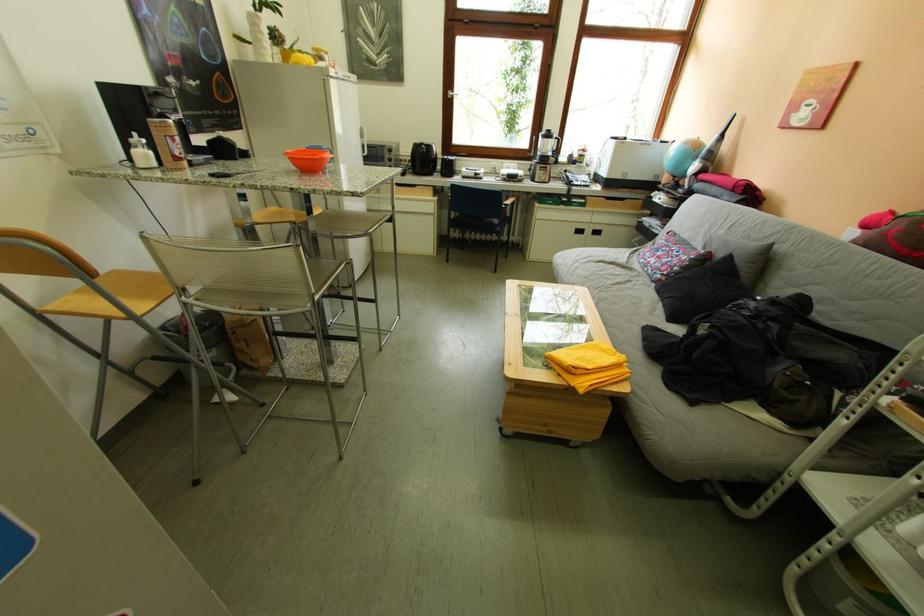
Image resolution: width=924 pixels, height=616 pixels. Describe the element at coordinates (665, 253) in the screenshot. I see `the drawer handle` at that location.